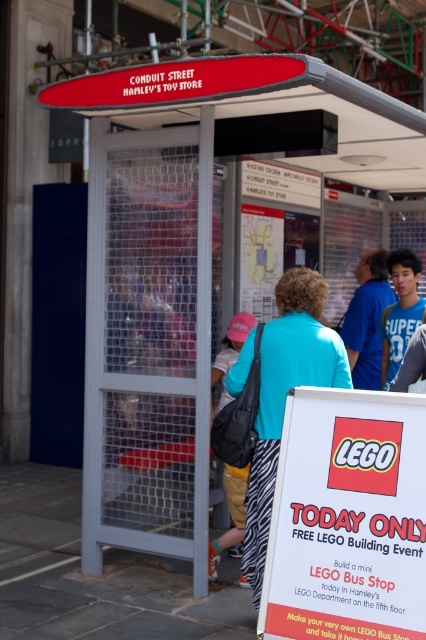
You are a photographer at Conduit Street, Hamley Toy Store. You want to take a photo of the zebra print skirt at center and the red plastic sign at upper center. Which object is located to the right of the other?

The zebra print skirt at center is positioned on the right side of red plastic sign at upper center.

You are a photographer at the Conduit Street bus stop. You want to capture a photo of the zebra print skirt at center and the red plastic sign at upper center in the same frame. Based on their sizes, which object will appear smaller in the photo?

The zebra print skirt at center has a lesser width compared to the red plastic sign at upper center, so it will appear smaller in the photo.